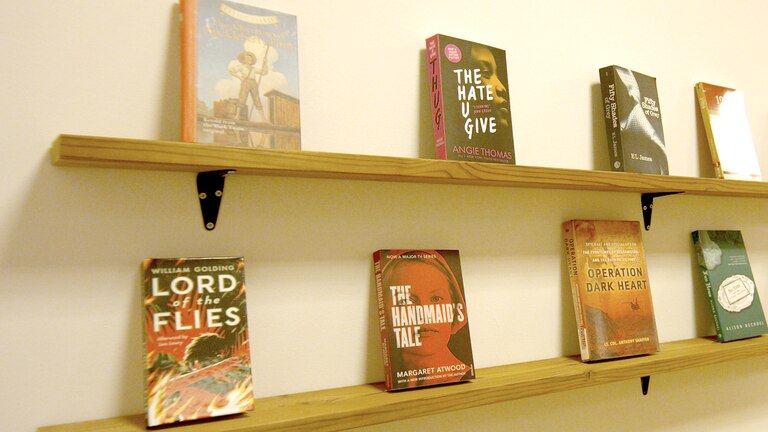
Locate an element on the screen. The height and width of the screenshot is (432, 768). books is located at coordinates (733, 117), (719, 249), (631, 127), (598, 261), (482, 115), (414, 299), (239, 102), (210, 317).